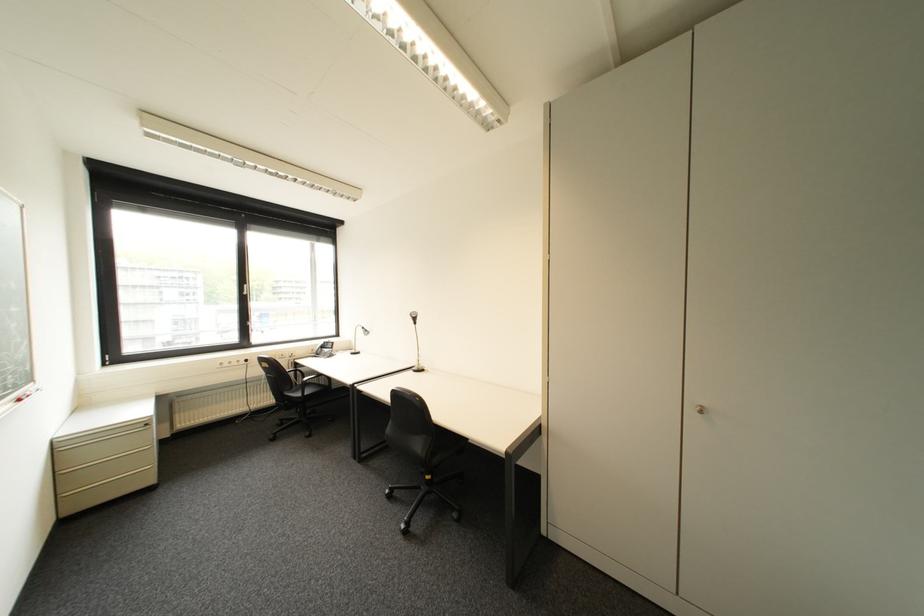
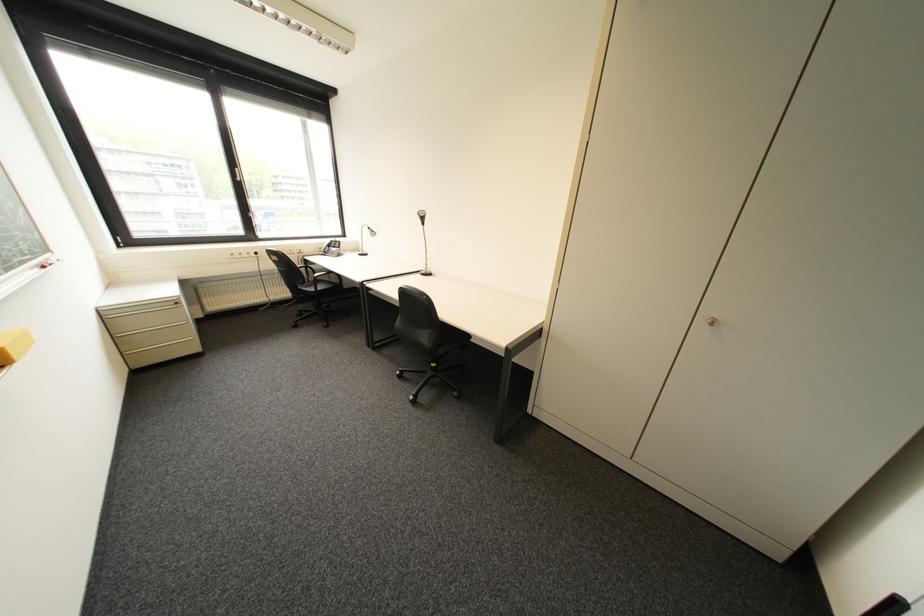
The point at (x=439, y=451) is marked in the first image. Where is the corresponding point in the second image?

(444, 342)